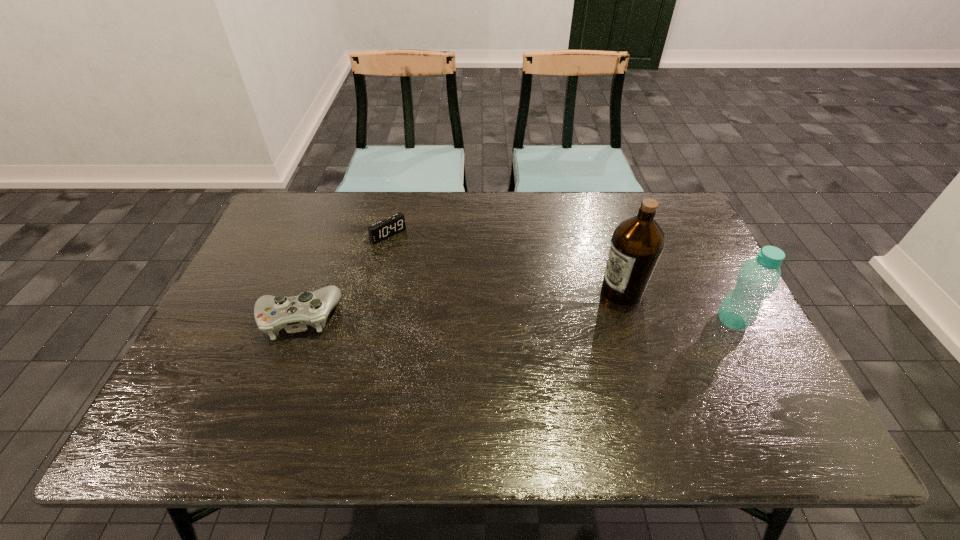
Where is `free space on the desktop that is between the control and the rightmost object and is positioned on the label of the tallest object`? The width and height of the screenshot is (960, 540). free space on the desktop that is between the control and the rightmost object and is positioned on the label of the tallest object is located at coordinates (562, 320).

I want to click on free spot on the desktop that is between the leftmost object and the rightmost object and is positioned on the front-facing side of the shortest object, so click(x=476, y=319).